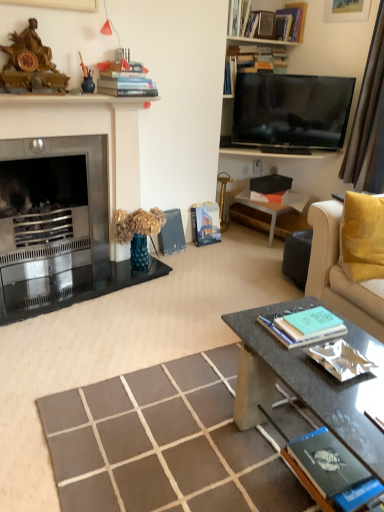
Locate an element on the screen. This screenshot has width=384, height=512. free area below shiny metallic book at center-right, the eighth book positioned from the top (from a real-world perspective) is located at coordinates (340, 380).